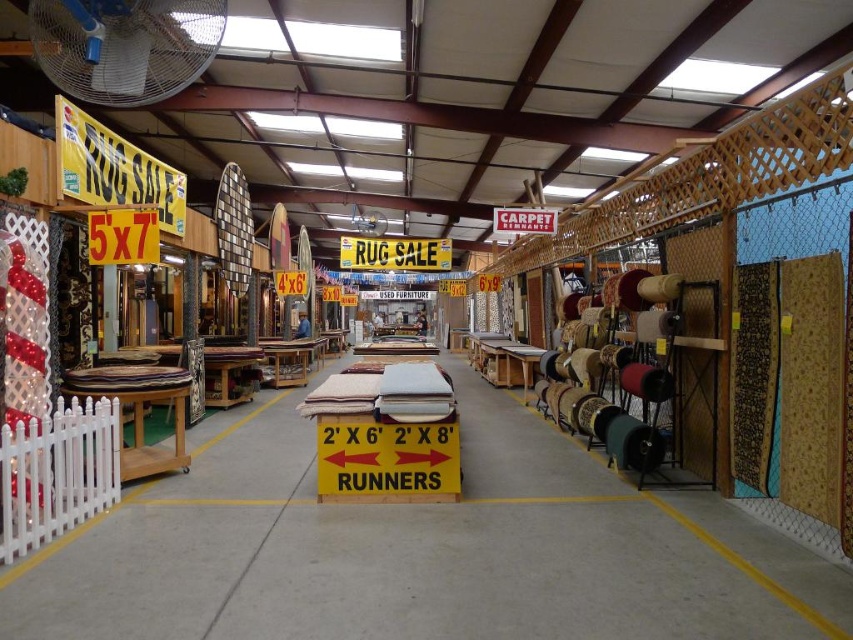
Question: Which is nearer to the red carpet remnant at center?

Choices:
 (A) white plastic fan at center
 (B) yellowmaterial/texturesign at center

Answer: (B)

Question: Does white plastic fan at upper left appear on the right side of red carpet remnant at center?

Choices:
 (A) no
 (B) yes

Answer: (A)

Question: Which object is farther from the camera taking this photo?

Choices:
 (A) yellowmaterial/texturesign at center
 (B) white plastic fan at center

Answer: (B)

Question: Is yellowmaterial/texturesign at center smaller than white plastic fan at center?

Choices:
 (A) yes
 (B) no

Answer: (A)

Question: Which of the following is the closest to the observer?

Choices:
 (A) white plastic fan at center
 (B) red carpet remnant at center
 (C) yellowmaterial/texturesign at center

Answer: (B)

Question: In this image, where is yellowmaterial/texturesign at center located relative to white plastic fan at center?

Choices:
 (A) below
 (B) above

Answer: (A)